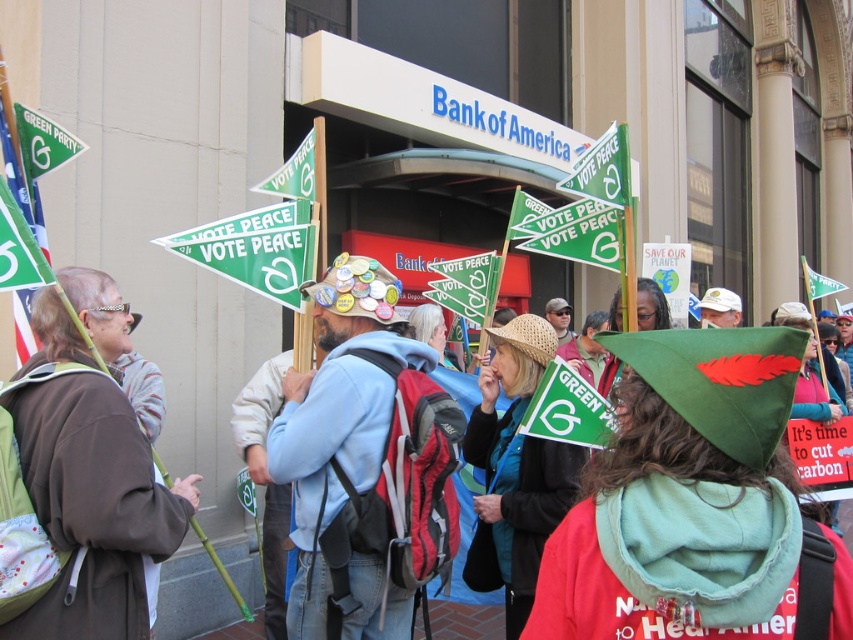
Question: Which object is the farthest from the green fabric hat at center?

Choices:
 (A) brown fabric robe at left
 (B) green felt hat at center
 (C) light blue fleece jacket at center
 (D) green paper sign at upper left

Answer: (D)

Question: Which of the following is the closest to the observer?

Choices:
 (A) green felt hat at center
 (B) green paper sign at upper left
 (C) brown fabric robe at left

Answer: (A)

Question: In this image, where is light blue fleece jacket at center located relative to green fabric hat at center?

Choices:
 (A) below
 (B) above

Answer: (B)

Question: Estimate the real-world distances between objects in this image. Which object is closer to the green paper sign at upper left?

Choices:
 (A) green fabric hat at center
 (B) brown fabric robe at left
 (C) green felt hat at center
 (D) light blue fleece jacket at center

Answer: (B)

Question: Can you confirm if brown fabric robe at left is smaller than light blue fleece jacket at center?

Choices:
 (A) no
 (B) yes

Answer: (B)

Question: Is green felt hat at center to the left of green paper sign at upper left from the viewer's perspective?

Choices:
 (A) yes
 (B) no

Answer: (B)